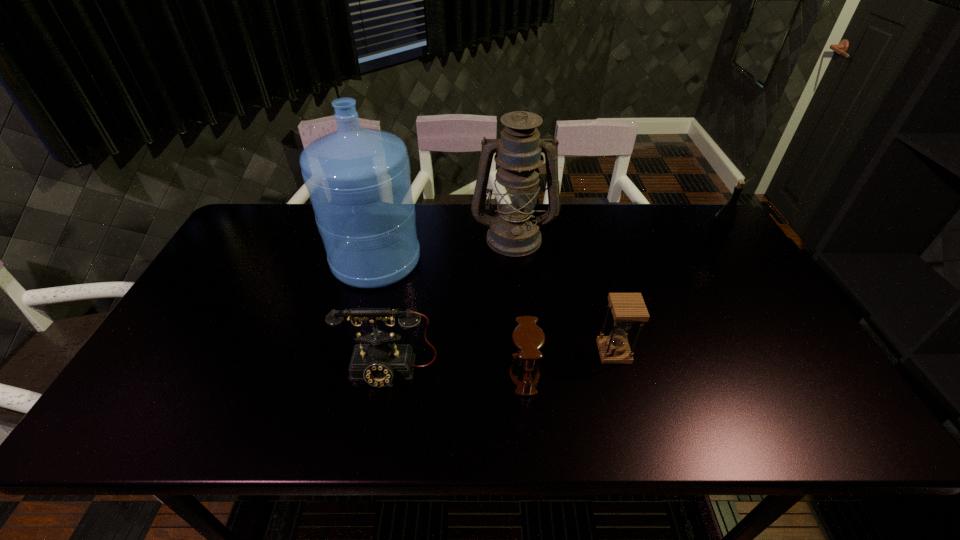
Where is `empty space between the telephone and the rightmost object`? The image size is (960, 540). empty space between the telephone and the rightmost object is located at coordinates (551, 309).

Find the location of `free space between the fifth shortest object and the second object from right to left`. free space between the fifth shortest object and the second object from right to left is located at coordinates (564, 294).

This screenshot has height=540, width=960. I want to click on free space that is in between the water jug and the fifth shortest object, so click(x=444, y=248).

Where is `vacant space that's between the water jug and the left hourglass`? Image resolution: width=960 pixels, height=540 pixels. vacant space that's between the water jug and the left hourglass is located at coordinates (450, 318).

Select which object appears as the closest to the water jug. Please provide its 2D coordinates. Your answer should be formatted as a tuple, i.e. [(x, y)], where the tuple contains the x and y coordinates of a point satisfying the conditions above.

[(514, 231)]

Point out which object is positioned as the third nearest to the left hourglass. Please provide its 2D coordinates. Your answer should be formatted as a tuple, i.e. [(x, y)], where the tuple contains the x and y coordinates of a point satisfying the conditions above.

[(358, 179)]

Image resolution: width=960 pixels, height=540 pixels. In order to click on vacant space that satisfies the following two spatial constraints: 1. on the dial of the shorter hourglass; 2. on the right side of the telephone in this screenshot , I will do `click(389, 375)`.

I want to click on blank area in the image that satisfies the following two spatial constraints: 1. on the side of the water jug with the handle; 2. on the right side of the rightmost object, so click(379, 247).

This screenshot has height=540, width=960. Find the location of `free location that satisfies the following two spatial constraints: 1. on the side of the water jug with the handle; 2. on the right side of the second tallest object`. free location that satisfies the following two spatial constraints: 1. on the side of the water jug with the handle; 2. on the right side of the second tallest object is located at coordinates (382, 237).

Locate an element on the screen. The image size is (960, 540). vacant region that satisfies the following two spatial constraints: 1. on the side of the water jug with the handle; 2. on the left side of the beer bottle is located at coordinates (379, 247).